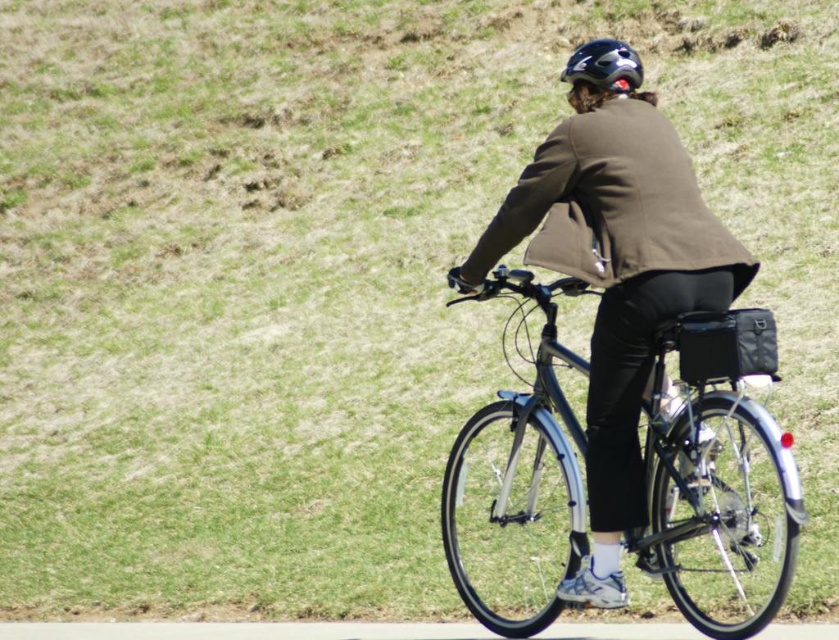
Question: Does shiny metallic bicycle at center have a larger size compared to glossy black helmet at upper center?

Choices:
 (A) yes
 (B) no

Answer: (B)

Question: Can you confirm if shiny metallic bicycle at center is positioned below glossy black helmet at upper center?

Choices:
 (A) yes
 (B) no

Answer: (A)

Question: Which point appears closest to the camera in this image?

Choices:
 (A) (501, 515)
 (B) (589, 64)

Answer: (B)

Question: Is shiny metallic bicycle at center positioned behind glossy black helmet at upper center?

Choices:
 (A) yes
 (B) no

Answer: (B)